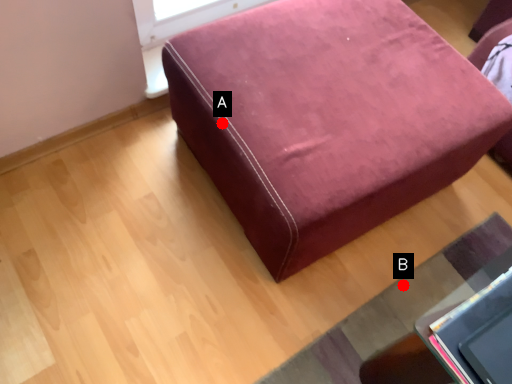
Question: Two points are circled on the image, labeled by A and B beside each circle. Which point is closer to the camera taking this photo?

Choices:
 (A) A is closer
 (B) B is closer

Answer: (A)